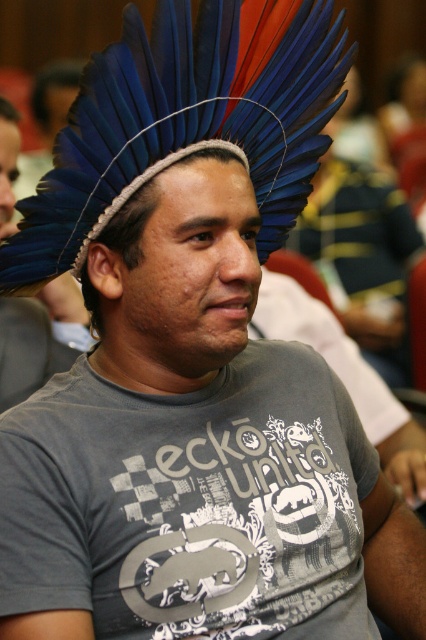
You are an interior designer assessing the space requirements for a cultural exhibition. You observe the blue feather headdress at upper center and the blue feathered headdress at upper center in the image. Which of these two headdresses has a greater width?

The blue feather headdress at upper center has a greater width than the blue feathered headdress at upper center according to the description.

You are an interior designer planning to hang a decorative item above a shelf in a room. The shelf currently has the blue feather headdress at upper center placed on it. Based on the image, is there enough vertical space between the shelf and the ceiling to place another decorative item above the blue feathered headdress at center?

The blue feathered headdress at center is located above the blue feather headdress at upper center, which suggests there is sufficient vertical space between the shelf and the ceiling to place another decorative item above the blue feathered headdress at center.